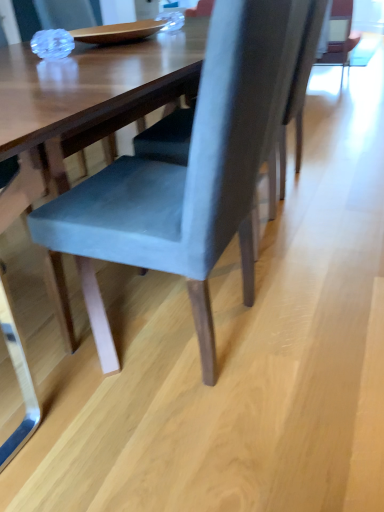
Describe the element at coordinates (188, 175) in the screenshot. I see `velvet blue chair at center, placed as the 1th chair when sorted from front to back` at that location.

Find the location of a particular element. This screenshot has height=512, width=384. velvet blue chair at center, the 2th chair from the back is located at coordinates (188, 175).

This screenshot has width=384, height=512. Describe the element at coordinates (304, 72) in the screenshot. I see `suede-like gray chair at center, marked as the first chair in a back-to-front arrangement` at that location.

What are the coordinates of `suede-like gray chair at center, the 2th chair viewed from the front` in the screenshot? It's located at (304, 72).

From the picture: What is the approximate width of suede-like gray chair at center, marked as the first chair in a back-to-front arrangement?

suede-like gray chair at center, marked as the first chair in a back-to-front arrangement, is 22.91 inches wide.

Identify the location of velvet blue chair at center, placed as the 1th chair when sorted from front to back. The height and width of the screenshot is (512, 384). (188, 175).

Is suede-like gray chair at center, the 2th chair viewed from the front, at the right side of velvet blue chair at center, the 2th chair from the back?

Yes, suede-like gray chair at center, the 2th chair viewed from the front, is to the right of velvet blue chair at center, the 2th chair from the back.

Does suede-like gray chair at center, marked as the first chair in a back-to-front arrangement, lie behind velvet blue chair at center, the 2th chair from the back?

That is True.

Does point (293, 103) lie in front of point (208, 258)?

No, it is behind (208, 258).

In the scene shown: From the image's perspective, which one is positioned higher, suede-like gray chair at center, marked as the first chair in a back-to-front arrangement, or velvet blue chair at center, placed as the 1th chair when sorted from front to back?

From the image's view, suede-like gray chair at center, marked as the first chair in a back-to-front arrangement, is above.

From a real-world perspective, does suede-like gray chair at center, the 2th chair viewed from the front, sit lower than velvet blue chair at center, placed as the 1th chair when sorted from front to back?

Correct, in the physical world, suede-like gray chair at center, the 2th chair viewed from the front, is lower than velvet blue chair at center, placed as the 1th chair when sorted from front to back.

Can you confirm if suede-like gray chair at center, the 2th chair viewed from the front, is wider than velvet blue chair at center, placed as the 1th chair when sorted from front to back?

Yes, suede-like gray chair at center, the 2th chair viewed from the front, is wider than velvet blue chair at center, placed as the 1th chair when sorted from front to back.

From their relative heights in the image, would you say suede-like gray chair at center, the 2th chair viewed from the front, is taller or shorter than velvet blue chair at center, placed as the 1th chair when sorted from front to back?

Clearly, suede-like gray chair at center, the 2th chair viewed from the front, is shorter compared to velvet blue chair at center, placed as the 1th chair when sorted from front to back.

Between suede-like gray chair at center, the 2th chair viewed from the front, and velvet blue chair at center, the 2th chair from the back, which one has larger size?

With larger size is velvet blue chair at center, the 2th chair from the back.

Is suede-like gray chair at center, the 2th chair viewed from the front, not inside velvet blue chair at center, the 2th chair from the back?

Absolutely, suede-like gray chair at center, the 2th chair viewed from the front, is external to velvet blue chair at center, the 2th chair from the back.

Is suede-like gray chair at center, the 2th chair viewed from the front, placed right next to velvet blue chair at center, the 2th chair from the back?

They are not placed beside each other.

Is suede-like gray chair at center, the 2th chair viewed from the front, positioned with its back to velvet blue chair at center, placed as the 1th chair when sorted from front to back?

That's not correct — suede-like gray chair at center, the 2th chair viewed from the front, is not looking away from velvet blue chair at center, placed as the 1th chair when sorted from front to back.

How many degrees apart are the facing directions of suede-like gray chair at center, marked as the first chair in a back-to-front arrangement, and velvet blue chair at center, the 2th chair from the back?

0.000106 degrees.

Measure the distance from suede-like gray chair at center, the 2th chair viewed from the front, to velvet blue chair at center, placed as the 1th chair when sorted from front to back.

suede-like gray chair at center, the 2th chair viewed from the front, and velvet blue chair at center, placed as the 1th chair when sorted from front to back, are 33.64 inches apart from each other.

This screenshot has height=512, width=384. I want to click on chair below the suede-like gray chair at center, the 2th chair viewed from the front (from the image's perspective), so click(x=188, y=175).

Between velvet blue chair at center, the 2th chair from the back, and suede-like gray chair at center, the 2th chair viewed from the front, which one appears on the right side from the viewer's perspective?

suede-like gray chair at center, the 2th chair viewed from the front, is more to the right.

Considering the positions of objects velvet blue chair at center, placed as the 1th chair when sorted from front to back, and suede-like gray chair at center, the 2th chair viewed from the front, in the image provided, who is in front, velvet blue chair at center, placed as the 1th chair when sorted from front to back, or suede-like gray chair at center, the 2th chair viewed from the front,?

Positioned in front is velvet blue chair at center, placed as the 1th chair when sorted from front to back.

Does point (134, 166) appear closer or farther from the camera than point (295, 101)?

Point (134, 166) is positioned closer to the camera compared to point (295, 101).

From the image's perspective, is velvet blue chair at center, the 2th chair from the back, on top of suede-like gray chair at center, marked as the first chair in a back-to-front arrangement?

No, from the image's perspective, velvet blue chair at center, the 2th chair from the back, is not above suede-like gray chair at center, marked as the first chair in a back-to-front arrangement.

From a real-world perspective, is velvet blue chair at center, the 2th chair from the back, physically located above or below suede-like gray chair at center, the 2th chair viewed from the front?

In terms of real-world spatial position, velvet blue chair at center, the 2th chair from the back, is above suede-like gray chair at center, the 2th chair viewed from the front.

Does velvet blue chair at center, the 2th chair from the back, have a lesser width compared to suede-like gray chair at center, marked as the first chair in a back-to-front arrangement?

Yes.

Between velvet blue chair at center, the 2th chair from the back, and suede-like gray chair at center, marked as the first chair in a back-to-front arrangement, which one has more height?

velvet blue chair at center, the 2th chair from the back.

Considering the relative sizes of velvet blue chair at center, placed as the 1th chair when sorted from front to back, and suede-like gray chair at center, marked as the first chair in a back-to-front arrangement, in the image provided, is velvet blue chair at center, placed as the 1th chair when sorted from front to back, smaller than suede-like gray chair at center, marked as the first chair in a back-to-front arrangement,?

No.

Is suede-like gray chair at center, the 2th chair viewed from the front, located within velvet blue chair at center, placed as the 1th chair when sorted from front to back?

Definitely not — suede-like gray chair at center, the 2th chair viewed from the front, is not inside velvet blue chair at center, placed as the 1th chair when sorted from front to back.

Are velvet blue chair at center, the 2th chair from the back, and suede-like gray chair at center, marked as the first chair in a back-to-front arrangement, making contact?

No, velvet blue chair at center, the 2th chair from the back, is not in contact with suede-like gray chair at center, marked as the first chair in a back-to-front arrangement.

Could you tell me if velvet blue chair at center, placed as the 1th chair when sorted from front to back, is turned towards suede-like gray chair at center, marked as the first chair in a back-to-front arrangement?

No, velvet blue chair at center, placed as the 1th chair when sorted from front to back, is not turned towards suede-like gray chair at center, marked as the first chair in a back-to-front arrangement.

In the image, there is a velvet blue chair at center, placed as the 1th chair when sorted from front to back. Where is `chair above it (from the image's perspective)`? The height and width of the screenshot is (512, 384). chair above it (from the image's perspective) is located at coordinates (304, 72).

The image size is (384, 512). I want to click on chair below the suede-like gray chair at center, marked as the first chair in a back-to-front arrangement (from the image's perspective), so click(188, 175).

Image resolution: width=384 pixels, height=512 pixels. In the image, there is a velvet blue chair at center, the 2th chair from the back. Identify the location of chair below it (from a real-world perspective). (304, 72).